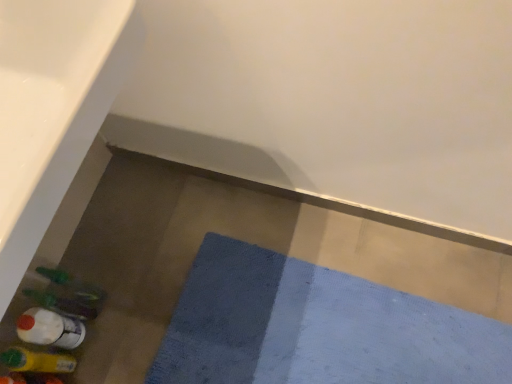
The height and width of the screenshot is (384, 512). I want to click on unoccupied region to the right of translucent plastic bottle at lower left, arranged as the first bottle when viewed from the top, so click(x=141, y=301).